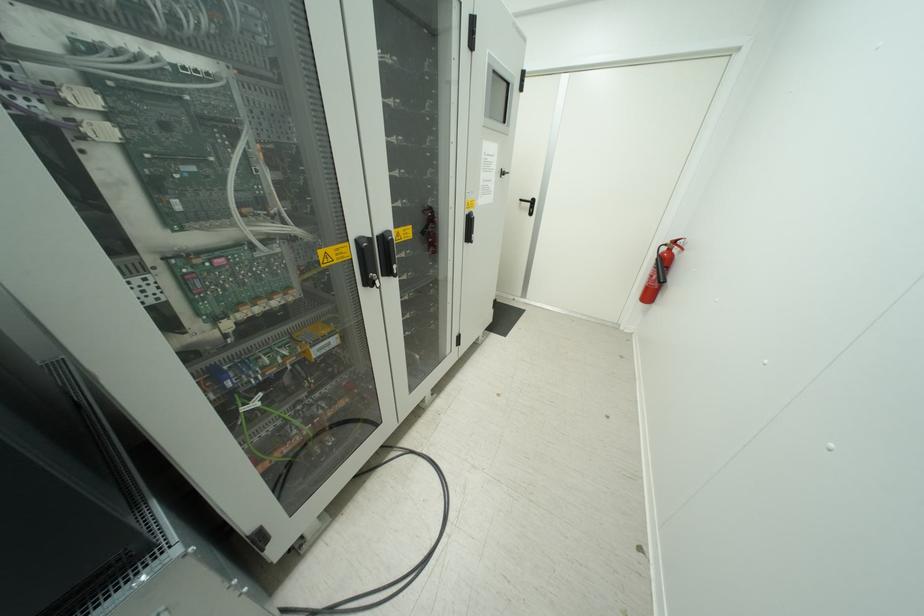
What do you see at coordinates (669, 257) in the screenshot? This screenshot has width=924, height=616. I see `a fire extinguisher handle` at bounding box center [669, 257].